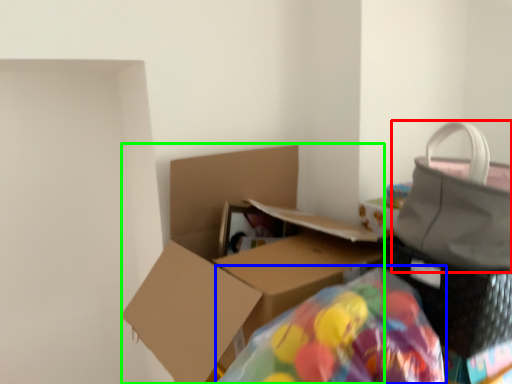
Question: Which is nearer to the handbag (highlighted by a red box)? bean bag chair (highlighted by a blue box) or box (highlighted by a green box).

Choices:
 (A) bean bag chair
 (B) box

Answer: (A)